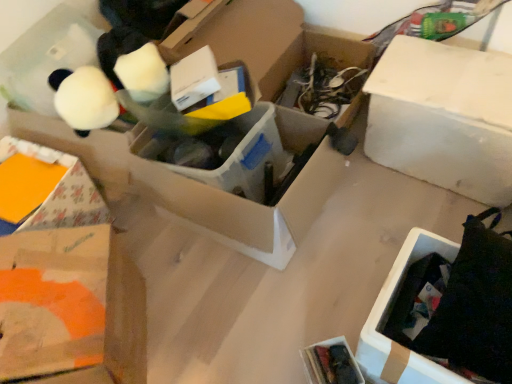
Question: Considering the relative sizes of white matte box at upper right and black cardboard box at lower right in the image provided, is white matte box at upper right shorter than black cardboard box at lower right?

Choices:
 (A) yes
 (B) no

Answer: (B)

Question: Is white matte box at upper right closer to camera compared to black cardboard box at lower right?

Choices:
 (A) no
 (B) yes

Answer: (A)

Question: From the image's perspective, is white matte box at upper right below black cardboard box at lower right?

Choices:
 (A) yes
 (B) no

Answer: (B)

Question: Does white matte box at upper right appear on the right side of black cardboard box at lower right?

Choices:
 (A) no
 (B) yes

Answer: (B)

Question: Can you confirm if white matte box at upper right is wider than black cardboard box at lower right?

Choices:
 (A) no
 (B) yes

Answer: (A)

Question: Does white matte box at upper right have a lesser width compared to black cardboard box at lower right?

Choices:
 (A) yes
 (B) no

Answer: (A)

Question: Considering the relative positions of black cardboard box at lower right and white matte box at upper right in the image provided, is black cardboard box at lower right to the right of white matte box at upper right from the viewer's perspective?

Choices:
 (A) no
 (B) yes

Answer: (A)

Question: Is white matte box at upper right at the back of black cardboard box at lower right?

Choices:
 (A) no
 (B) yes

Answer: (B)

Question: Does black cardboard box at lower right turn towards white matte box at upper right?

Choices:
 (A) no
 (B) yes

Answer: (A)

Question: Is black cardboard box at lower right located outside white matte box at upper right?

Choices:
 (A) yes
 (B) no

Answer: (A)

Question: Can you confirm if black cardboard box at lower right is smaller than white matte box at upper right?

Choices:
 (A) yes
 (B) no

Answer: (A)

Question: Would you say white matte box at upper right is part of black cardboard box at lower right's contents?

Choices:
 (A) no
 (B) yes

Answer: (A)

Question: From a real-world perspective, is white matte box at upper right above or below black cardboard box at lower right?

Choices:
 (A) below
 (B) above

Answer: (B)